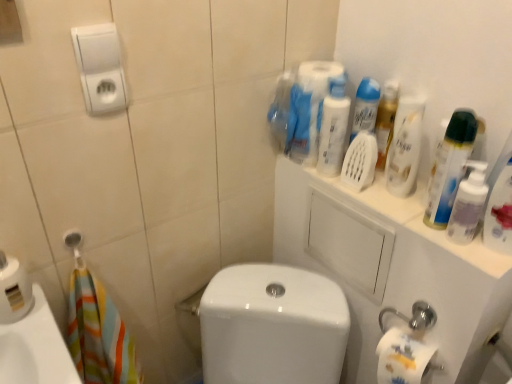
The width and height of the screenshot is (512, 384). I want to click on empty space that is ontop of white glossy porcelain at upper right, which ranks as the second porcelain in left-to-right order (from a real-world perspective), so click(391, 200).